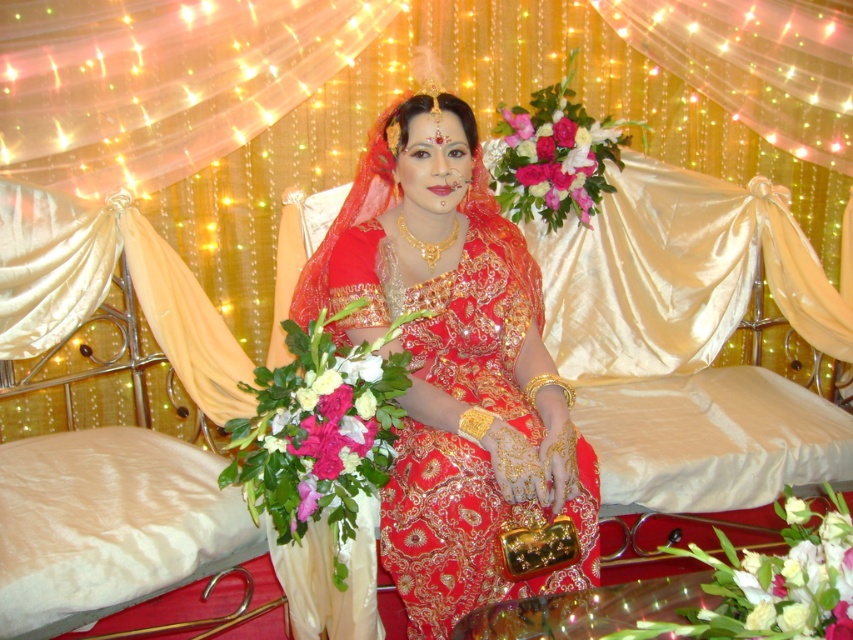
Which of these two, matte gold jewelry at center or pink silk flower at center, stands shorter?

pink silk flower at center is shorter.

What do you see at coordinates (456, 365) in the screenshot? The image size is (853, 640). I see `matte gold jewelry at center` at bounding box center [456, 365].

Measure the distance between matte gold jewelry at center and camera.

matte gold jewelry at center is 5.15 feet from camera.

At what (x,y) coordinates should I click in order to perform the action: click on matte gold jewelry at center. Please return your answer as a coordinate pair (x, y). Looking at the image, I should click on (456, 365).

Which of these two, matte gold jewelry at center or pink silk bouquet at center, stands shorter?

Standing shorter between the two is pink silk bouquet at center.

Is point (538, 432) more distant than point (592, 124)?

No, (538, 432) is in front of (592, 124).

Is point (524, 500) positioned in front of point (506, 173)?

Yes, point (524, 500) is in front of point (506, 173).

Identify the location of matte gold jewelry at center. This screenshot has height=640, width=853. (456, 365).

Is point (268, 461) closer to viewer compared to point (637, 122)?

Yes, point (268, 461) is closer to viewer.

What do you see at coordinates (320, 433) in the screenshot?
I see `pink silk flower at center` at bounding box center [320, 433].

The image size is (853, 640). Find the location of `pink silk flower at center`. pink silk flower at center is located at coordinates (320, 433).